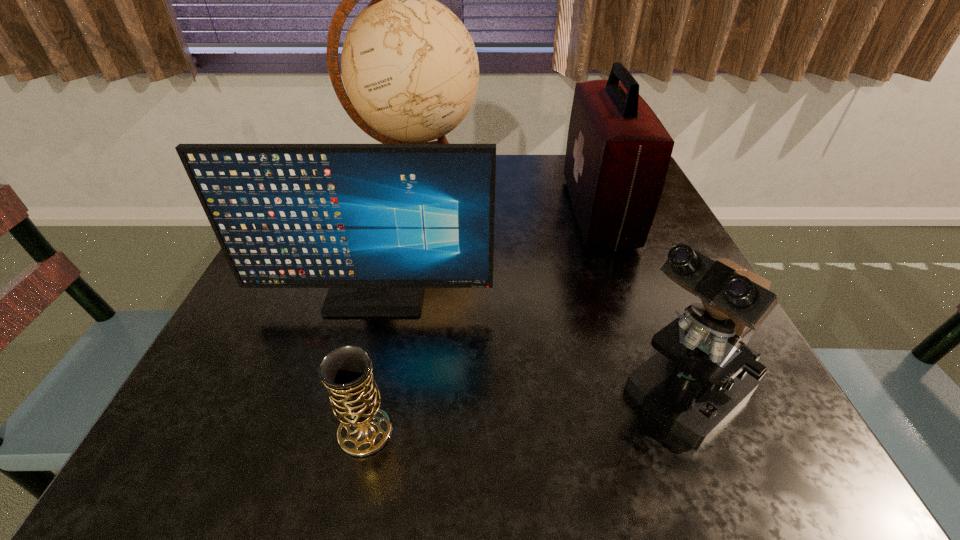
You are a GUI agent. You are given a task and a screenshot of the screen. Output one action in this format:
    pyautogui.click(x=<x>, y=<y>)
    Task: Click on the vacant area between the first aid kit and the tallest object
    This screenshot has width=960, height=540.
    Given the screenshot: What is the action you would take?
    pyautogui.click(x=507, y=201)

Image resolution: width=960 pixels, height=540 pixels. What are the coordinates of `vacant space in between the globe and the first aid kit` in the screenshot? It's located at (507, 201).

What are the coordinates of `vacant area that lies between the microscope and the third farthest object` in the screenshot? It's located at (527, 346).

Locate an element on the screen. This screenshot has width=960, height=540. vacant area between the microscope and the computer monitor is located at coordinates (527, 346).

I want to click on the closest object to the first aid kit, so click(375, 223).

Where is `object that stands as the third closest to the microscope`? This screenshot has width=960, height=540. object that stands as the third closest to the microscope is located at coordinates (346, 371).

The width and height of the screenshot is (960, 540). I want to click on blank space that satisfies the following two spatial constraints: 1. on the back side of the microscope; 2. on the side of the first aid kit with the cross symbol, so [608, 212].

The image size is (960, 540). What are the coordinates of `free region that satisfies the following two spatial constraints: 1. on the screen side of the computer monitor; 2. on the right side of the microscope` in the screenshot? It's located at click(349, 394).

At what (x,y) coordinates should I click in order to perform the action: click on vacant point that satisfies the following two spatial constraints: 1. on the side of the first aid kit with the cross symbol; 2. on the left side of the microscope. Please return your answer as a coordinate pair (x, y). This screenshot has height=540, width=960. Looking at the image, I should click on (665, 394).

Find the location of a particular element. The width and height of the screenshot is (960, 540). vacant space that satisfies the following two spatial constraints: 1. on the surface of the globe; 2. on the left side of the microscope is located at coordinates (373, 394).